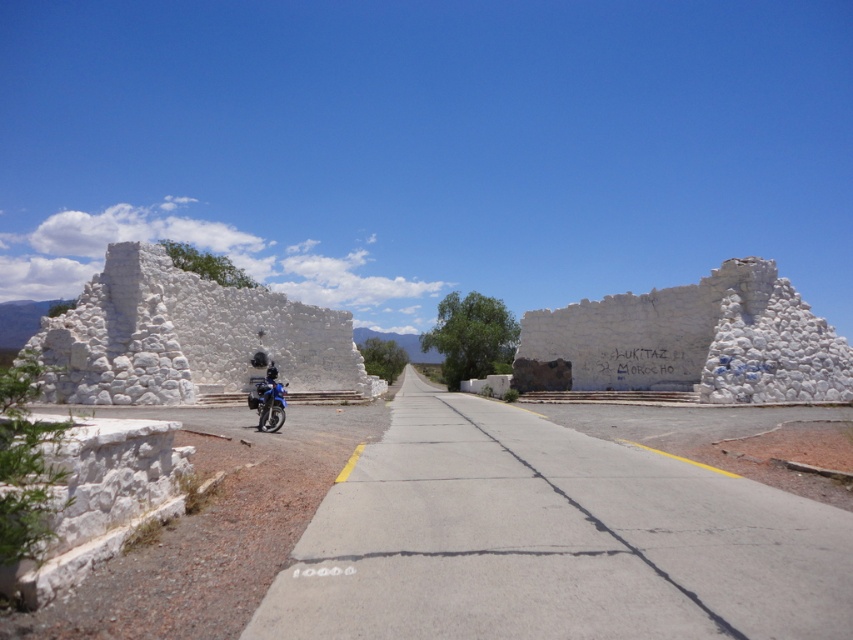
Question: Does white stone ruins at left have a lesser width compared to blue metallic motorcycle at center?

Choices:
 (A) yes
 (B) no

Answer: (B)

Question: Which of the following is the farthest from the observer?

Choices:
 (A) (338, 333)
 (B) (693, 330)
 (C) (276, 372)

Answer: (A)

Question: In this image, where is white stone ruins at center located relative to blue metallic motorcycle at center?

Choices:
 (A) above
 (B) below

Answer: (A)

Question: Considering the real-world distances, which object is farthest from the blue metallic motorcycle at center?

Choices:
 (A) white stone ruins at left
 (B) white stone ruins at center

Answer: (B)

Question: Is white stone ruins at left to the right of white stone ruins at center from the viewer's perspective?

Choices:
 (A) no
 (B) yes

Answer: (A)

Question: Which object is farther from the camera taking this photo?

Choices:
 (A) white stone ruins at left
 (B) blue metallic motorcycle at center
 (C) white stone ruins at center

Answer: (C)